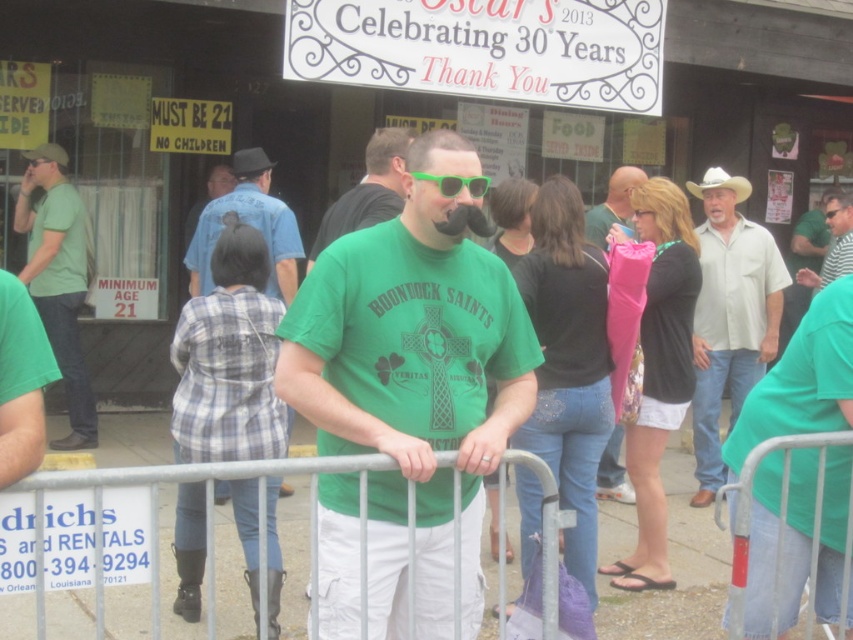
Question: Can you confirm if green t-shirt at center is positioned to the right of pink fabric umbrella at center?

Choices:
 (A) no
 (B) yes

Answer: (B)

Question: Based on their relative distances, which object is farther from the metal at center?

Choices:
 (A) green matte shirt at center
 (B) green matte t-shirt at center
 (C) striped shirt at center

Answer: (C)

Question: Based on their relative distances, which object is farther from the green plastic sunglasses at center?

Choices:
 (A) pink fabric umbrella at center
 (B) striped shirt at center
 (C) blue plaid shirt at center

Answer: (B)

Question: Where is blue plaid shirt at center located in relation to pink fabric umbrella at center in the image?

Choices:
 (A) below
 (B) above

Answer: (A)

Question: Which of the following is the farthest from the observer?

Choices:
 (A) coord(824,218)
 (B) coord(412,172)
 (C) coord(283,257)

Answer: (A)

Question: Is green matte shirt at left above pink fabric umbrella at center?

Choices:
 (A) yes
 (B) no

Answer: (B)